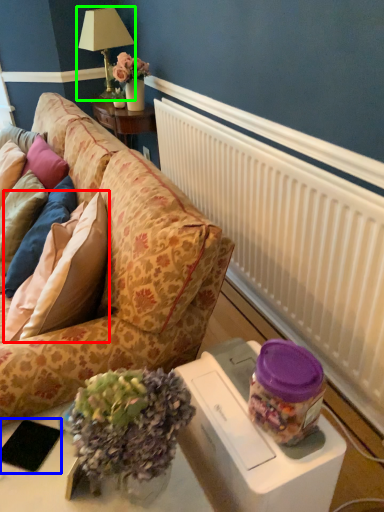
Question: Considering the real-world distances, which object is closest to pillow (highlighted by a red box)? pad (highlighted by a blue box) or table lamp (highlighted by a green box).

Choices:
 (A) pad
 (B) table lamp

Answer: (A)